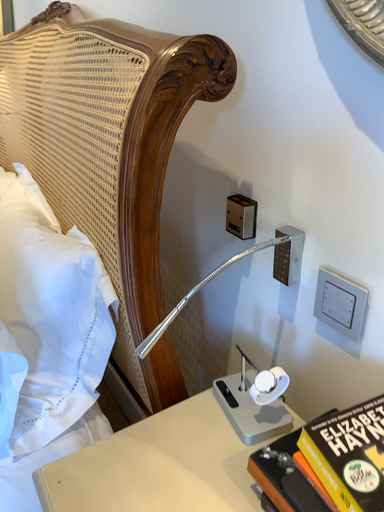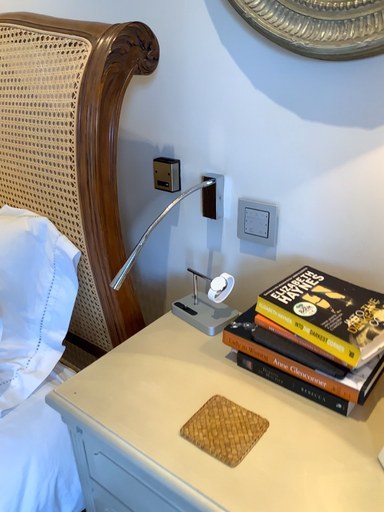
Question: How did the camera likely rotate when shooting the video?

Choices:
 (A) rotated left
 (B) rotated right

Answer: (B)